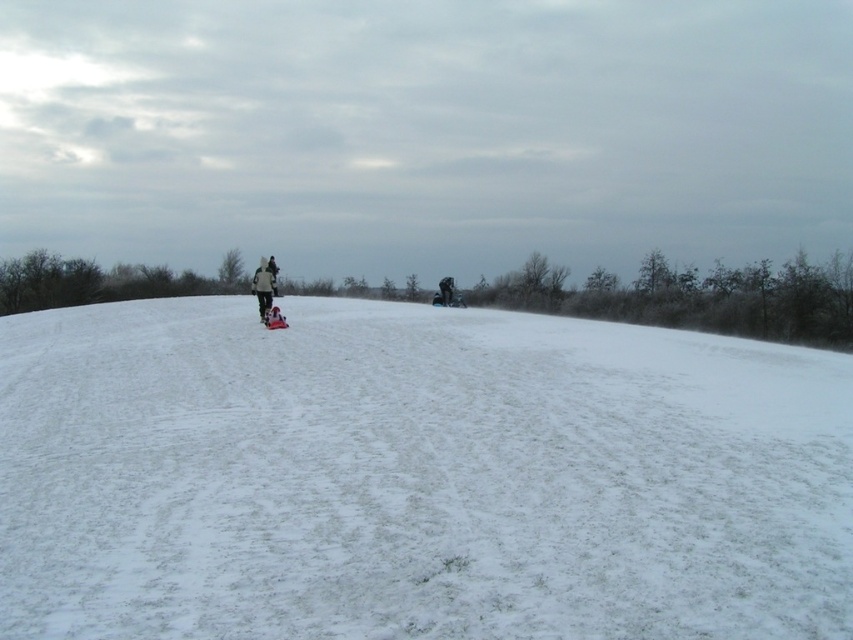
Is white fluffy snow at center below dark gray fleece jacket at center?

Indeed, white fluffy snow at center is positioned under dark gray fleece jacket at center.

Does white fluffy snow at center appear on the right side of dark gray fleece jacket at center?

Indeed, white fluffy snow at center is positioned on the right side of dark gray fleece jacket at center.

What are the coordinates of `white fluffy snow at center` in the screenshot? It's located at (415, 476).